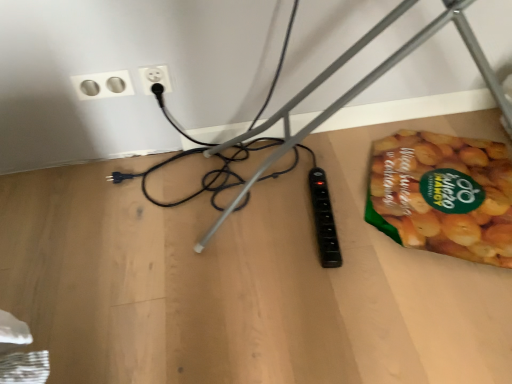
Where is `free point in front of green matte snack packet at lower right`? free point in front of green matte snack packet at lower right is located at coordinates (426, 317).